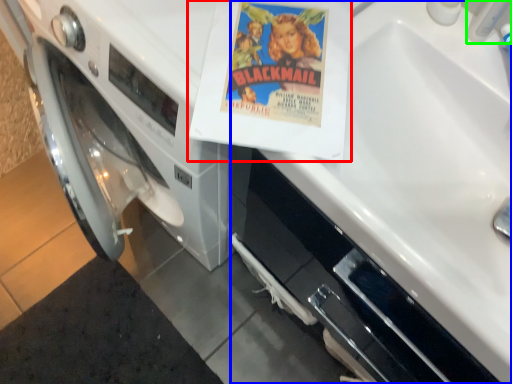
Question: Based on their relative distances, which object is nearer to paperback book (highlighted by a red box)? Choose from sink (highlighted by a blue box) and faucet (highlighted by a green box).

Choices:
 (A) sink
 (B) faucet

Answer: (B)